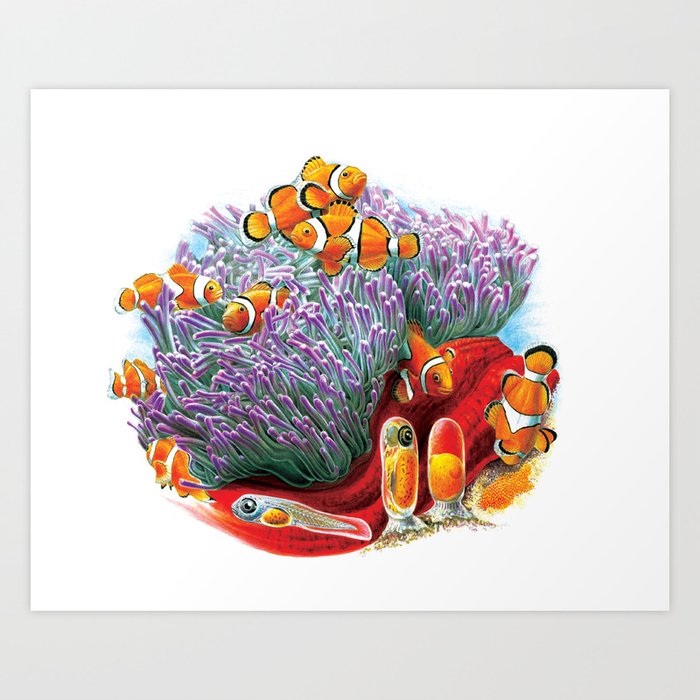
This screenshot has width=700, height=700. In order to click on 1 piece of paper in this screenshot , I will do `click(581, 491)`.